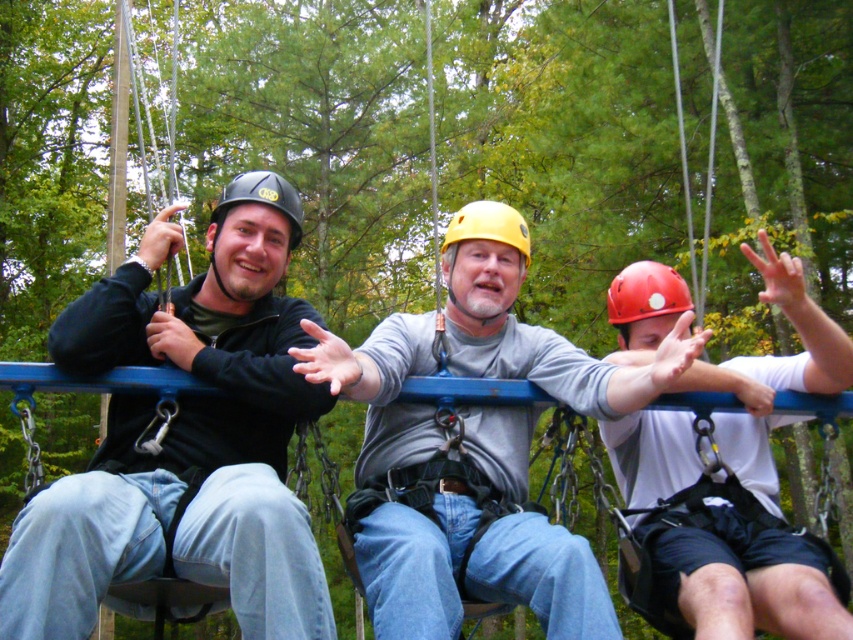
You are a safety inspector checking the distance between the individuals on the platform. The minimum safe distance required between each person is 4 meters. Is the current distance between the matte black helmet at center and the other individuals compliant with safety standards?

The individuals are 3.85 meters apart, which is less than the required 4 meters. Therefore, the current distance between the matte black helmet at center and the others does not comply with safety standards.

You are a safety inspector checking the distance between the gray matte helmet at center and the black matte helmet at center. The safety regulation requires that helmets must be at least 1.6 meters apart to avoid collisions. Is the current distance compliant with the regulation?

The gray matte helmet at center is 1.59 meters from the black matte helmet at center. Since the required distance is 1.6 meters, the current distance is 0.01 meters too short, so it does not comply with the safety regulation.